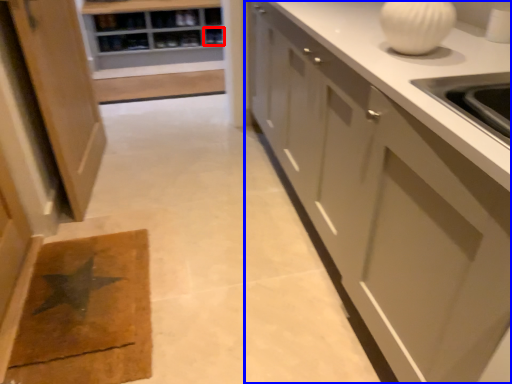
Question: Which point is closer to the camera, shelf (highlighted by a red box) or cabinetry (highlighted by a blue box)?

Choices:
 (A) shelf
 (B) cabinetry

Answer: (B)